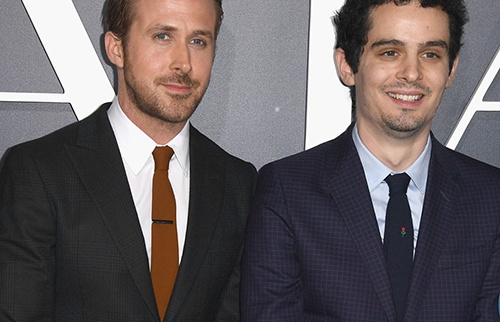
Locate an element on the screen. The width and height of the screenshot is (500, 322). grey wall is located at coordinates (269, 127).